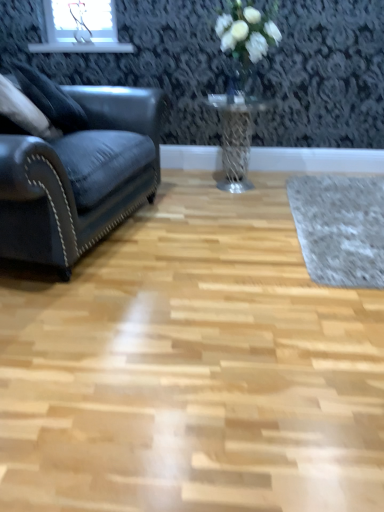
The height and width of the screenshot is (512, 384). I want to click on free space to the left of metallic mesh table at center, so click(x=173, y=190).